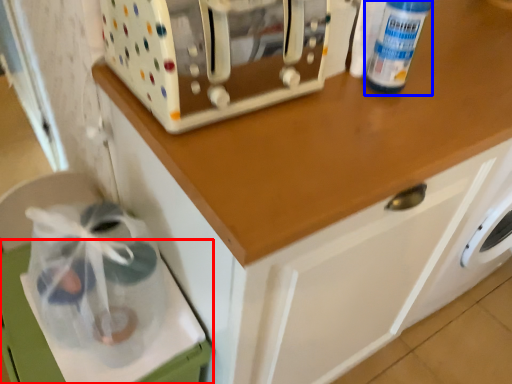
Question: Which object appears closest to the camera in this image, cabinetry (highlighted by a red box) or bottle (highlighted by a blue box)?

Choices:
 (A) cabinetry
 (B) bottle

Answer: (B)